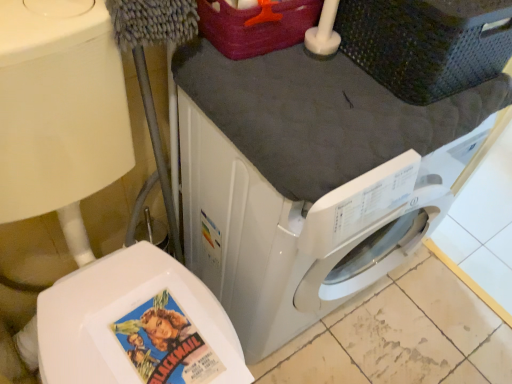
What do you see at coordinates (302, 229) in the screenshot? I see `white glossy washing machine at center` at bounding box center [302, 229].

Describe the element at coordinates (426, 44) in the screenshot. This screenshot has width=512, height=384. I see `dark gray plastic basket at upper right` at that location.

Find the location of a particular element. white glossy washing machine at center is located at coordinates (302, 229).

Can you tell me how much dark gray plastic basket at upper right and matte paper comic book at lower left differ in facing direction?

They differ by 96.9 degrees in their facing directions.

Is point (453, 62) closer or farther from the camera than point (145, 380)?

Point (453, 62).

Between dark gray plastic basket at upper right and matte paper comic book at lower left, which one is positioned behind?

matte paper comic book at lower left is further away from the camera.

From the image's perspective, between matte paper comic book at lower left and white glossy washing machine at center, which one is located above?

white glossy washing machine at center, from the image's perspective.

From the picture: Which object is thinner, matte paper comic book at lower left or white glossy washing machine at center?

matte paper comic book at lower left is thinner.

Could you tell me if matte paper comic book at lower left is turned towards white glossy washing machine at center?

No, matte paper comic book at lower left is not turned towards white glossy washing machine at center.

Considering the points (504, 48) and (414, 177), which point is in front, point (504, 48) or point (414, 177)?

The point (414, 177) is in front.

Is dark gray plastic basket at upper right situated inside white glossy washing machine at center or outside?

dark gray plastic basket at upper right cannot be found inside white glossy washing machine at center.

How different are the orientations of dark gray plastic basket at upper right and white glossy washing machine at center in degrees?

They differ by 89.4 degrees in their facing directions.

Can you confirm if dark gray plastic basket at upper right is smaller than white glossy washing machine at center?

Correct, dark gray plastic basket at upper right occupies less space than white glossy washing machine at center.

Which of these two, white glossy washing machine at center or dark gray plastic basket at upper right, stands shorter?

With less height is dark gray plastic basket at upper right.

Which is more to the left, white glossy washing machine at center or dark gray plastic basket at upper right?

white glossy washing machine at center is more to the left.

Is white glossy washing machine at center in front of dark gray plastic basket at upper right?

Yes, white glossy washing machine at center is in front of dark gray plastic basket at upper right.

Considering the relative sizes of white glossy washing machine at center and matte paper comic book at lower left in the image provided, is white glossy washing machine at center taller than matte paper comic book at lower left?

Yes.

Locate an element on the screen. This screenshot has height=384, width=512. washing machine above the matte paper comic book at lower left (from the image's perspective) is located at coordinates (302, 229).

Is point (191, 124) behind point (146, 348)?

Yes, point (191, 124) is farther from viewer.

Is white glossy washing machine at center spatially inside matte paper comic book at lower left, or outside of it?

The correct answer is: outside.

Who is smaller, matte paper comic book at lower left or dark gray plastic basket at upper right?

Smaller between the two is matte paper comic book at lower left.

Between matte paper comic book at lower left and dark gray plastic basket at upper right, which one is positioned in front?

dark gray plastic basket at upper right is in front.

Is matte paper comic book at lower left positioned far away from dark gray plastic basket at upper right?

That's not correct — matte paper comic book at lower left is a little close to dark gray plastic basket at upper right.

From the image's perspective, which is above, matte paper comic book at lower left or dark gray plastic basket at upper right?

dark gray plastic basket at upper right, from the image's perspective.

Where is `basket above the matte paper comic book at lower left (from the image's perspective)`? The width and height of the screenshot is (512, 384). basket above the matte paper comic book at lower left (from the image's perspective) is located at coordinates (426, 44).

At what (x,y) coordinates should I click in order to perform the action: click on washing machine in front of the matte paper comic book at lower left. Please return your answer as a coordinate pair (x, y). Looking at the image, I should click on (302, 229).

From the image, which object appears to be farther from white glossy washing machine at center, matte paper comic book at lower left or dark gray plastic basket at upper right?

dark gray plastic basket at upper right lies further to white glossy washing machine at center than the other object.

From the image, which object appears to be farther from matte paper comic book at lower left, dark gray plastic basket at upper right or white glossy washing machine at center?

dark gray plastic basket at upper right.

Considering their positions, is dark gray plastic basket at upper right positioned further to white glossy washing machine at center than matte paper comic book at lower left?

dark gray plastic basket at upper right is further to white glossy washing machine at center.

Considering their positions, is white glossy washing machine at center positioned further to dark gray plastic basket at upper right than matte paper comic book at lower left?

matte paper comic book at lower left is positioned further to the anchor dark gray plastic basket at upper right.

Estimate the real-world distances between objects in this image. Which object is closer to matte paper comic book at lower left, white glossy washing machine at center or dark gray plastic basket at upper right?

white glossy washing machine at center is positioned closer to the anchor matte paper comic book at lower left.

Based on their spatial positions, is matte paper comic book at lower left or white glossy washing machine at center further from dark gray plastic basket at upper right?

The object further to dark gray plastic basket at upper right is matte paper comic book at lower left.

Where is `washing machine between dark gray plastic basket at upper right and matte paper comic book at lower left vertically`? washing machine between dark gray plastic basket at upper right and matte paper comic book at lower left vertically is located at coordinates (302, 229).